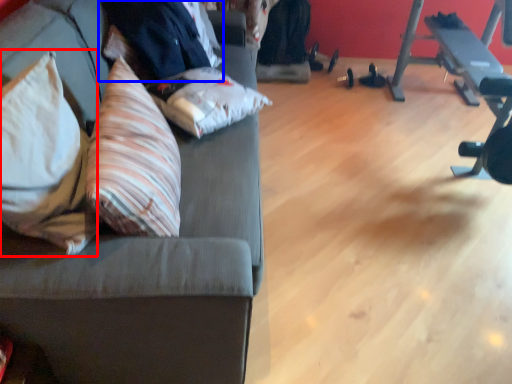
Question: Which object appears farthest to the camera in this image, throw pillow (highlighted by a red box) or businessman (highlighted by a blue box)?

Choices:
 (A) throw pillow
 (B) businessman

Answer: (B)